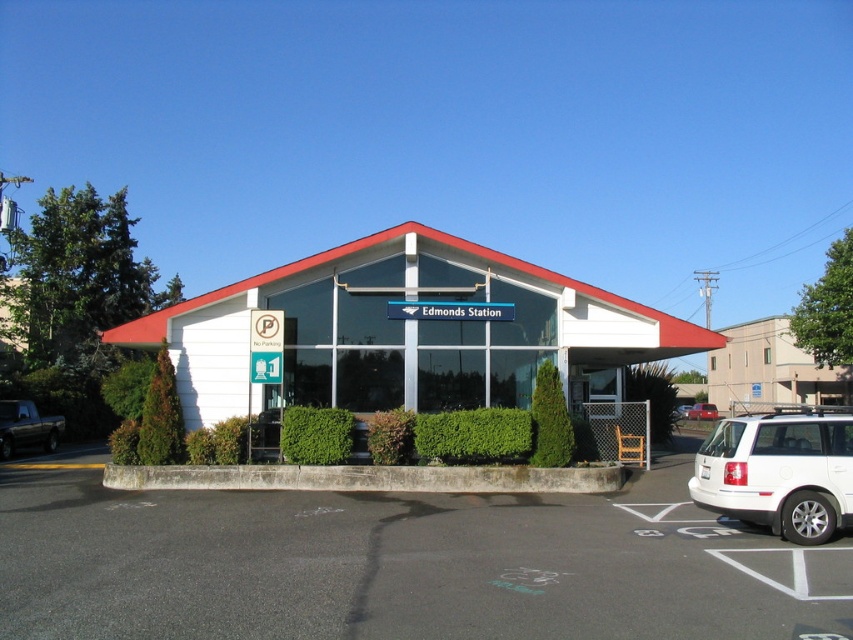
The width and height of the screenshot is (853, 640). I want to click on gray asphalt parking lot at center, so click(x=401, y=564).

Does gray asphalt parking lot at center have a greater height compared to metallic silver suv at center?

No, gray asphalt parking lot at center is not taller than metallic silver suv at center.

Find the location of a particular element. The image size is (853, 640). gray asphalt parking lot at center is located at coordinates coord(401,564).

Between gray asphalt parking lot at center and white matte suv at lower right, which one has less height?

gray asphalt parking lot at center

Which of these two, gray asphalt parking lot at center or white matte suv at lower right, stands taller?

white matte suv at lower right is taller.

I want to click on gray asphalt parking lot at center, so click(401, 564).

The image size is (853, 640). In order to click on gray asphalt parking lot at center in this screenshot , I will do `click(401, 564)`.

From the picture: Between gray asphalt parking lot at center and metallic silver sedan at center, which one has less height?

metallic silver sedan at center

Which is in front, point (316, 572) or point (704, 404)?

Point (316, 572) is more forward.

This screenshot has height=640, width=853. In order to click on gray asphalt parking lot at center in this screenshot , I will do `click(401, 564)`.